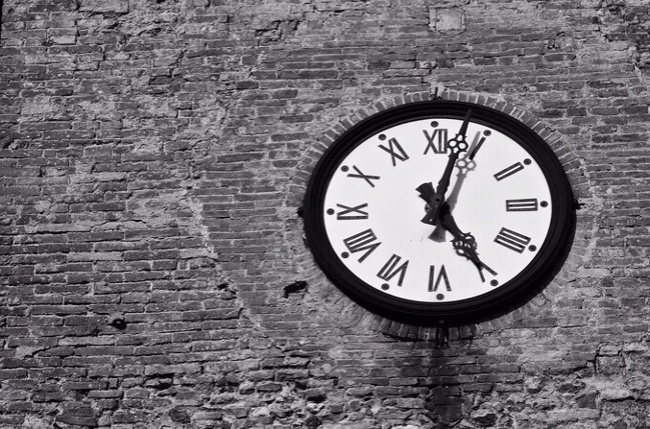
I want to click on clock, so click(389, 205).